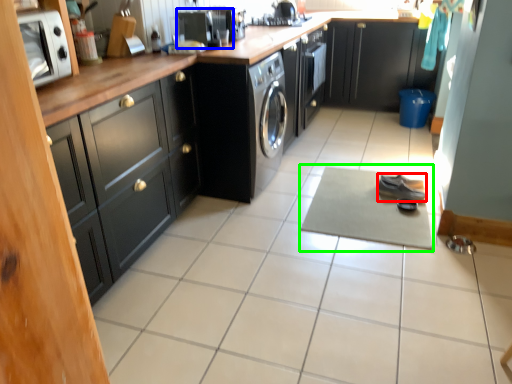
Question: Which is farther away from shoe (highlighted by a red box)? appliance (highlighted by a blue box) or yoga mat (highlighted by a green box)?

Choices:
 (A) appliance
 (B) yoga mat

Answer: (A)